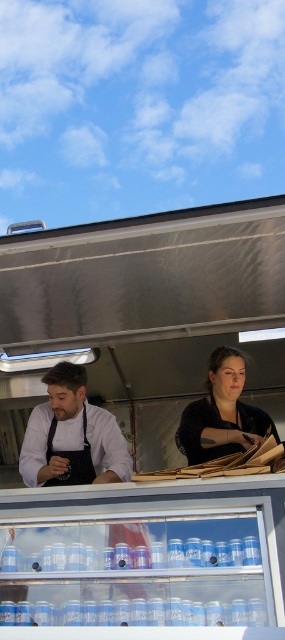
Question: Does brushed metal food truck at center appear on the right side of matte black jacket at center?

Choices:
 (A) no
 (B) yes

Answer: (A)

Question: Is brushed metal food truck at center to the left of matte black jacket at center from the viewer's perspective?

Choices:
 (A) no
 (B) yes

Answer: (B)

Question: Which object appears closest to the camera in this image?

Choices:
 (A) matte black jacket at center
 (B) brushed metal food truck at center
 (C) matte black apron at left
 (D) black fabric apron at left

Answer: (B)

Question: Is matte black jacket at center bigger than black fabric apron at left?

Choices:
 (A) yes
 (B) no

Answer: (A)

Question: Which point is farther to the camera?

Choices:
 (A) matte black apron at left
 (B) black fabric apron at left

Answer: (B)

Question: Which object is closer to the camera taking this photo?

Choices:
 (A) black fabric apron at left
 (B) brushed metal food truck at center
 (C) matte black apron at left
 (D) matte black jacket at center

Answer: (B)